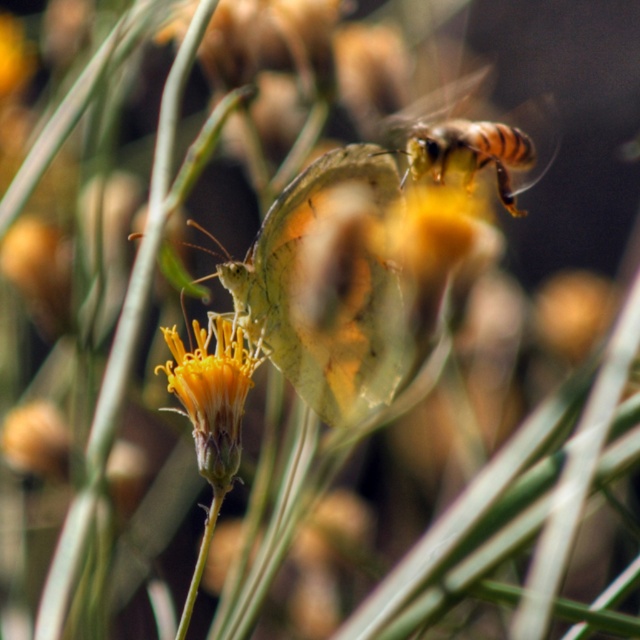
You are a photographer trying to capture a close shot of the translucent yellow butterfly at center and the yellow matte flower at center. The camera has a depth of field setting that can focus on objects within a 5 inch range. Will both subjects be in focus if you set the focus point exactly halfway between them?

The distance between the translucent yellow butterfly at center and the yellow matte flower at center is 7.84 inches. Since the depth of field can only focus within a 5 inch range, setting the focus halfway would leave the outer edges beyond the 5 inch limit. Therefore, both subjects cannot be in focus simultaneously.

You are a photographer trying to capture the translucent yellow butterfly at center and the brown striped bee at upper right in a single frame. Based on their sizes in the image, which one would you need to zoom in more to fully capture in your photo?

The translucent yellow butterfly at center occupies less space than the brown striped bee at upper right, so you would need to zoom in more to capture the brown striped bee at upper right fully since it takes up more space in the image.